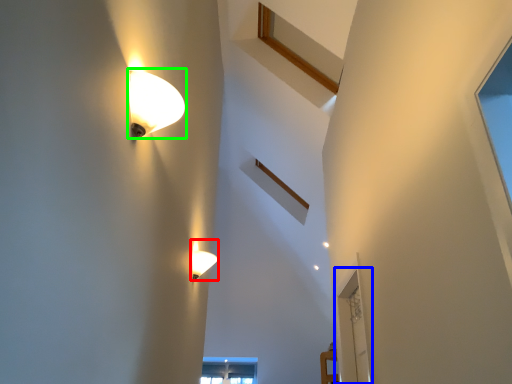
Question: Which object is positioned farthest from lamp (highlighted by a red box)? Select from glass door (highlighted by a blue box) and lamp (highlighted by a green box).

Choices:
 (A) glass door
 (B) lamp

Answer: (B)